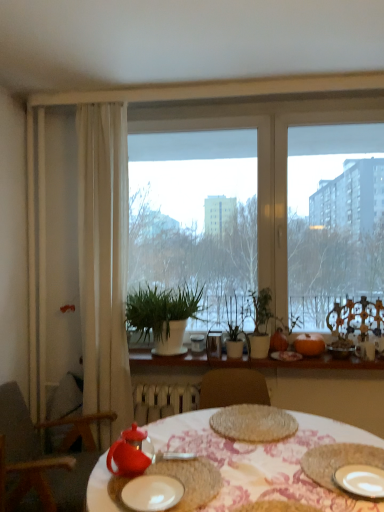
Find the location of a particular element. The width and height of the screenshot is (384, 512). vacant area that lies between white ceramic plate at lower right, placed as the first plate when sorted from right to left, and white matte plate at center, the 2th plate viewed from the right is located at coordinates (255, 490).